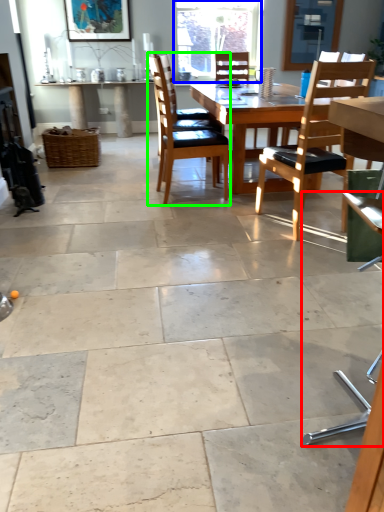
Question: Which object is positioned closest to chair (highlighted by a red box)? Select from window (highlighted by a blue box) and chair (highlighted by a green box).

Choices:
 (A) window
 (B) chair

Answer: (B)